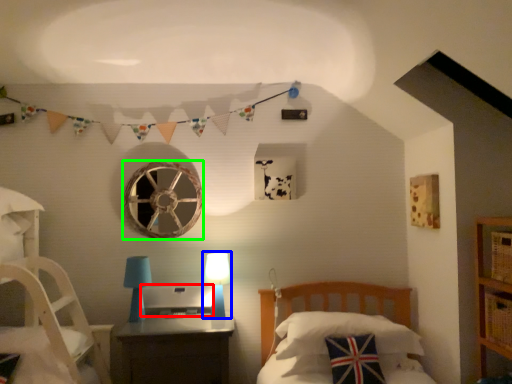
Question: Which object is positioned closest to desktop (highlighted by a red box)? Select from table lamp (highlighted by a blue box) and oval (highlighted by a green box).

Choices:
 (A) table lamp
 (B) oval

Answer: (A)